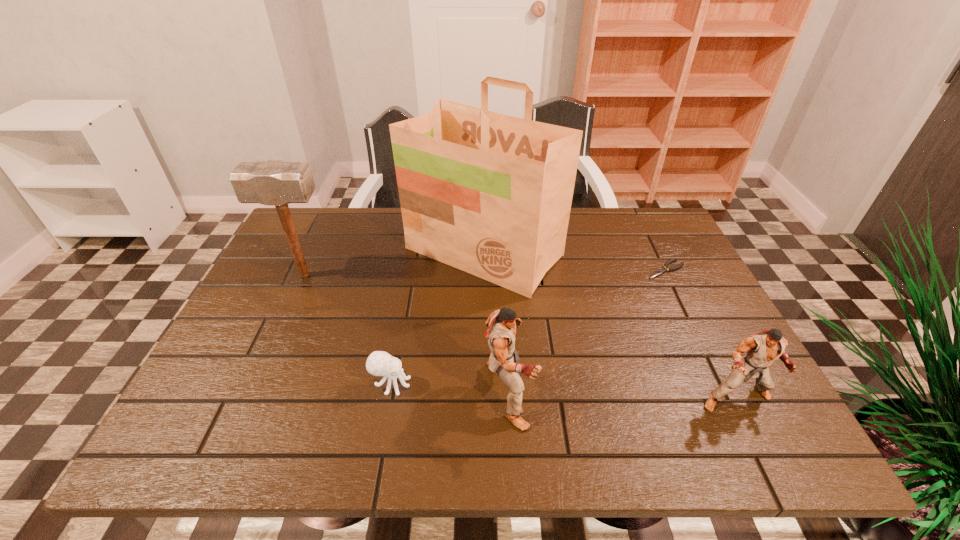
The height and width of the screenshot is (540, 960). In the image, there is a desktop. Identify the location of vacant space at the far edge. (364, 231).

In order to click on vacant space at the near edge of the desktop in this screenshot , I will do `click(382, 396)`.

Where is `vacant area at the left edge`? vacant area at the left edge is located at coordinates (261, 325).

Find the location of `vacant space at the right edge of the desktop`. vacant space at the right edge of the desktop is located at coordinates (688, 282).

In the image, there is a desktop. Identify the location of free region at the far right corner. Image resolution: width=960 pixels, height=540 pixels. (638, 248).

The width and height of the screenshot is (960, 540). I want to click on unoccupied position between the grocery bag and the fifth shortest object, so click(x=395, y=264).

I want to click on empty space between the shorter puncher and the grocery bag, so click(610, 326).

Find the location of a particular element. The image size is (960, 540). vacant space in between the fourth tallest object and the mallet is located at coordinates (520, 337).

You are a GUI agent. You are given a task and a screenshot of the screen. Output one action in this format:
    pyautogui.click(x=<x>, y=<y>)
    Task: Click on the blank region between the right puncher and the leftmost object
    This screenshot has width=960, height=540.
    Given the screenshot: What is the action you would take?
    pyautogui.click(x=520, y=337)

Locate an element on the screen. The width and height of the screenshot is (960, 540). vacant space that is in between the pliers and the tallest object is located at coordinates (575, 261).